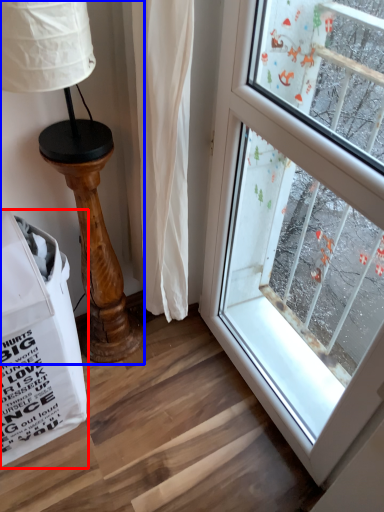
Question: Which object is closer to the camera taking this photo, grocery bag (highlighted by a red box) or table lamp (highlighted by a blue box)?

Choices:
 (A) grocery bag
 (B) table lamp

Answer: (A)